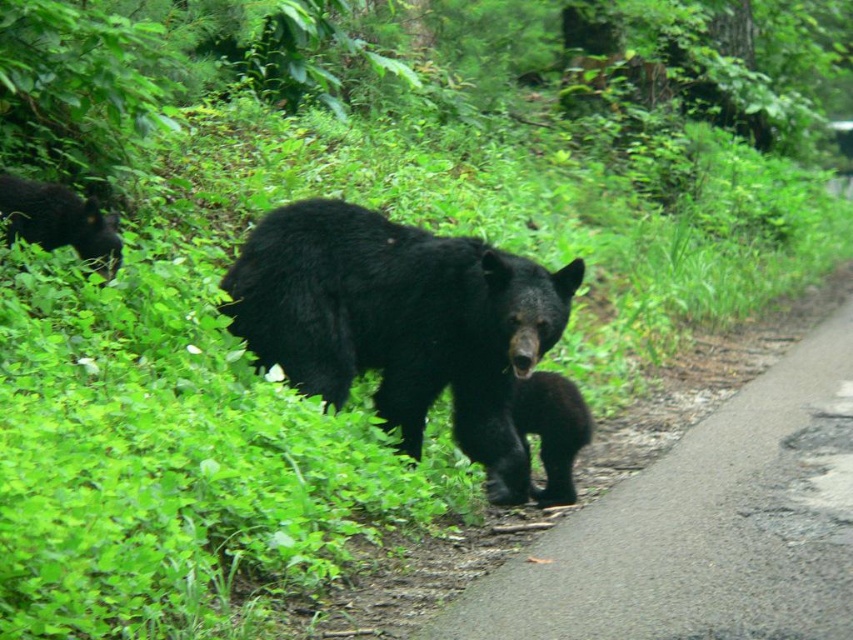
You are a wildlife photographer aiming to capture a photo of both the black furry bear at center and the black furry bear cub at center. Since you want to ensure both are in focus, you need to know their sizes relative to each other. Which bear is bigger?

The black furry bear at center is larger in size compared to the black furry bear cub at center, so you should adjust your camera settings to accommodate the size difference for better focus.

You are a wildlife photographer positioned at the origin point of the scene. You want to capture a photo of the shiny black bear at left. What is the exact coordinate where you should aim your camera?

The shiny black bear at left is located at point (59,221), so you should aim your camera at those coordinates to capture the bear.

You are a wildlife photographer aiming to capture the bears in this scene. You notice a specific point at coordinates (401, 323). Which bear is located at this point?

The point at coordinates (401, 323) corresponds to the black furry bear at center.